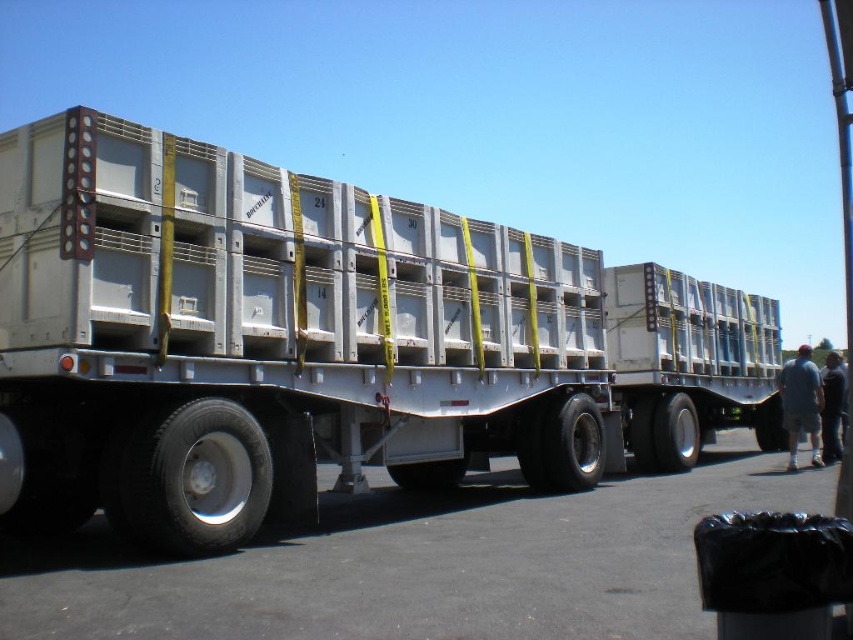
You are a delivery person trying to load a new package onto the metallic gray trailer truck at center. However, there is an obstacle blocking your path near the gray cotton shorts at lower right. Can you estimate if the obstacle is shorter than the trailer truck to safely navigate around it?

The metallic gray trailer truck at center is taller than gray cotton shorts at lower right, so the obstacle near the gray cotton shorts at lower right is shorter than the trailer truck. Therefore, you can safely navigate around the obstacle as it is shorter than the trailer truck.

You are a delivery person who needs to unload the metallic gray trailer truck at center. There are gray cotton shorts at lower right nearby. Which object is closer to the right edge of the image?

The gray cotton shorts at lower right are closer to the right edge of the image because the metallic gray trailer truck at center is to the left of them.